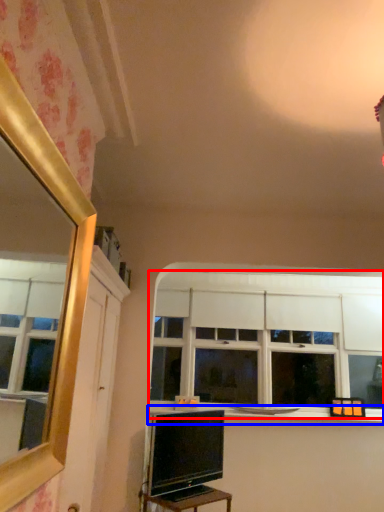
Question: Which object is closer to the camera taking this photo, window (highlighted by a red box) or window sill (highlighted by a blue box)?

Choices:
 (A) window
 (B) window sill

Answer: (B)